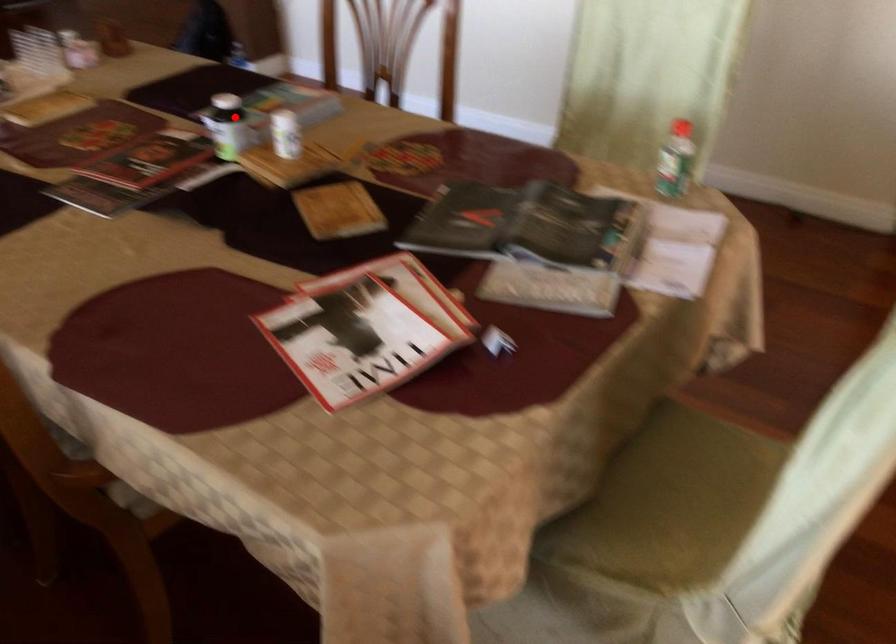
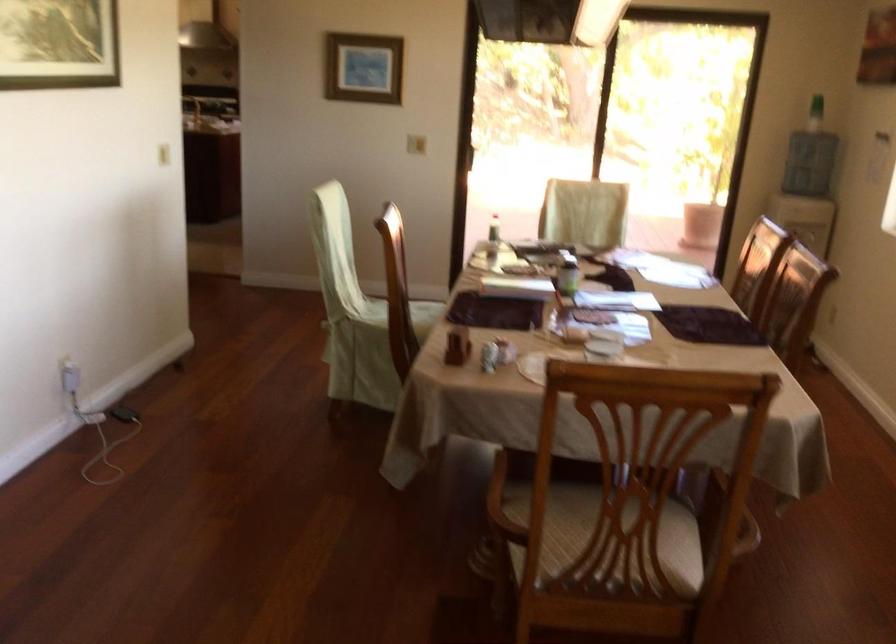
Question: I am providing you with two images of the same scene from different viewpoints. Image1 has a red point marked. In image2, the corresponding 3D location appears at what relative position? Reply with the corresponding letter.

Choices:
 (A) Closer
 (B) Farther

Answer: (B)